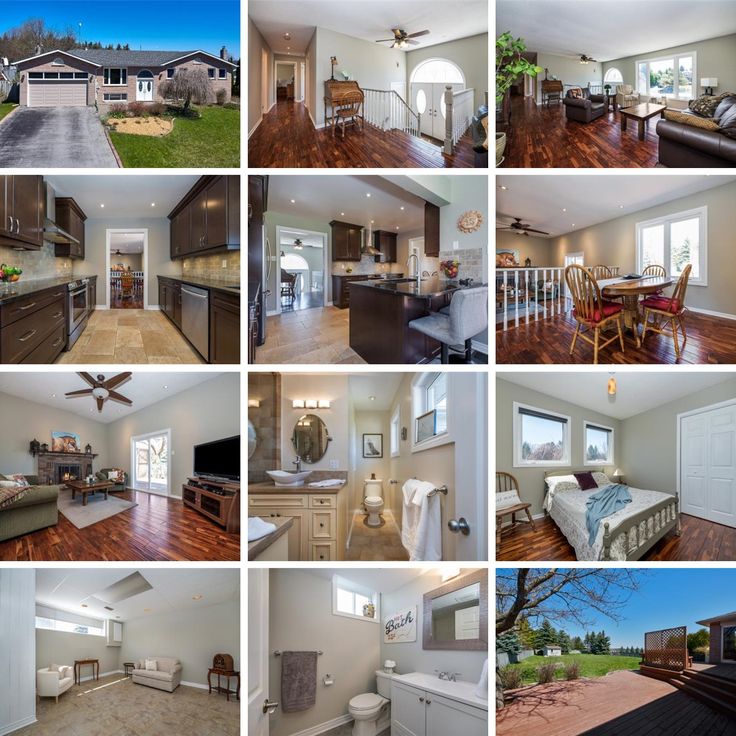
This screenshot has width=736, height=736. What are the coordinates of `wood flooring` in the screenshot? It's located at (300, 137), (526, 132), (553, 333), (710, 542), (152, 541).